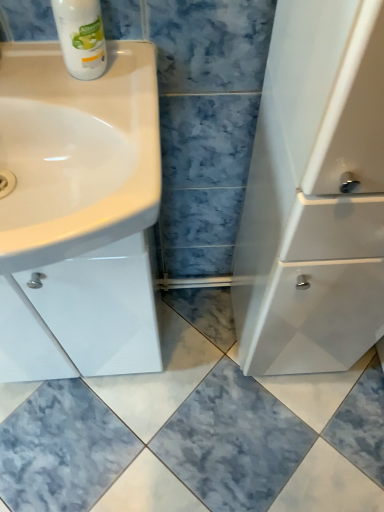
Question: Considering the positions of white glossy sink at left and white glossy bottle at upper left in the image, is white glossy sink at left bigger or smaller than white glossy bottle at upper left?

Choices:
 (A) big
 (B) small

Answer: (A)

Question: Is white glossy sink at left in front of or behind white glossy bottle at upper left in the image?

Choices:
 (A) front
 (B) behind

Answer: (A)

Question: In terms of height, does white glossy sink at left look taller or shorter compared to white glossy bottle at upper left?

Choices:
 (A) tall
 (B) short

Answer: (B)

Question: Is white glossy bottle at upper left spatially inside white glossy sink at left, or outside of it?

Choices:
 (A) inside
 (B) outside

Answer: (B)

Question: Considering the positions of white glossy bottle at upper left and white glossy sink at left in the image, is white glossy bottle at upper left wider or thinner than white glossy sink at left?

Choices:
 (A) thin
 (B) wide

Answer: (A)

Question: From their relative heights in the image, would you say white glossy bottle at upper left is taller or shorter than white glossy sink at left?

Choices:
 (A) short
 (B) tall

Answer: (B)

Question: Considering the positions of point (69, 3) and point (39, 83), is point (69, 3) closer or farther from the camera than point (39, 83)?

Choices:
 (A) farther
 (B) closer

Answer: (B)